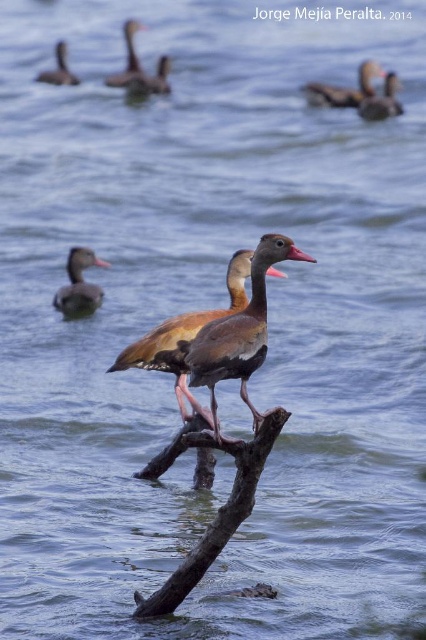
I want to click on brown matte duck at center, so click(239, 333).

Describe the element at coordinates (239, 333) in the screenshot. Image resolution: width=426 pixels, height=640 pixels. I see `brown matte duck at center` at that location.

Where is `brown matte duck at center`? The height and width of the screenshot is (640, 426). brown matte duck at center is located at coordinates (239, 333).

Can you confirm if brown matte duck at center is positioned above matte brown duck at upper left?

Actually, brown matte duck at center is below matte brown duck at upper left.

Is brown matte duck at center smaller than matte brown duck at upper left?

Incorrect, brown matte duck at center is not smaller in size than matte brown duck at upper left.

Does point (259, 419) lie behind point (62, 296)?

No, it is not.

The image size is (426, 640). What are the coordinates of `brown matte duck at center` in the screenshot? It's located at (239, 333).

Does brown wood at center appear under brown matte duck at center?

Correct, brown wood at center is located below brown matte duck at center.

Between point (169, 456) and point (284, 237), which one is positioned behind?

The point (169, 456) is more distant.

Which is in front, point (249, 464) or point (250, 342)?

Point (250, 342)

Locate an element on the screen. Image resolution: width=426 pixels, height=640 pixels. brown wood at center is located at coordinates (218, 509).